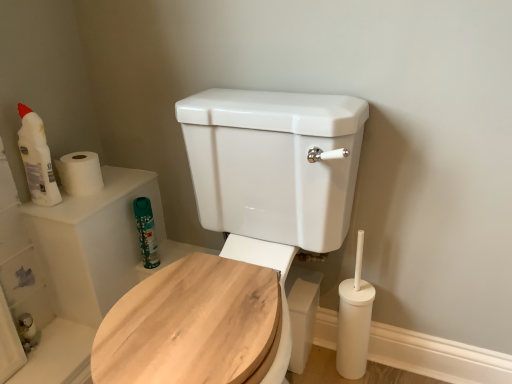
You are a GUI agent. You are given a task and a screenshot of the screen. Output one action in this format:
    pyautogui.click(x=<x>, y=<y>)
    Task: Click on the vacant space to the right of white matte toilet paper at upper left
    The image size is (512, 384).
    Given the screenshot: What is the action you would take?
    pyautogui.click(x=123, y=184)